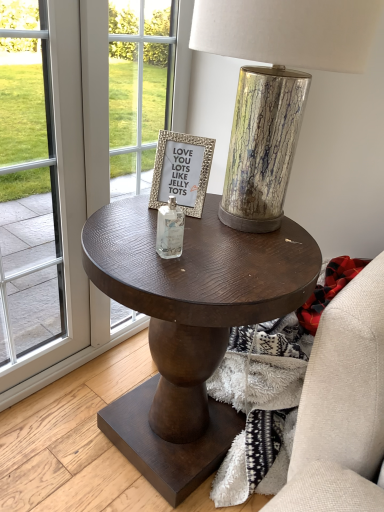
Identify the location of free location to the left of clear glass bottle at center. The width and height of the screenshot is (384, 512). (117, 242).